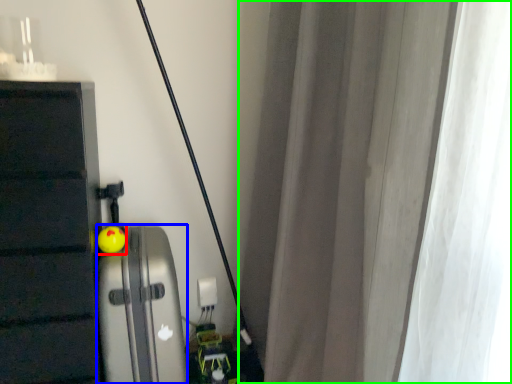
Question: Which object is positioned closest to toy (highlighted by a red box)? Select from appliance (highlighted by a blue box) and curtain (highlighted by a green box).

Choices:
 (A) appliance
 (B) curtain

Answer: (A)